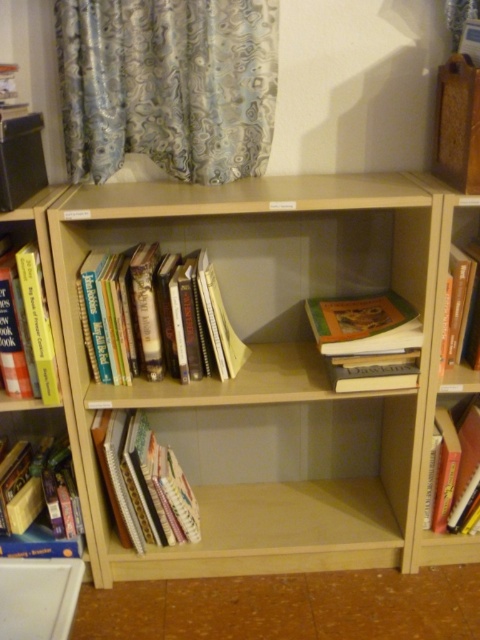
Question: Which point is farther from the camera taking this photo?

Choices:
 (A) (135, 67)
 (B) (23, 314)
 (C) (178, 321)
 (D) (248, 188)

Answer: (D)

Question: Does hardcover book at lower left appear on the left side of hardcover book at right?

Choices:
 (A) yes
 (B) no

Answer: (A)

Question: Is blue-patterned curtain at upper left closer to camera compared to hardcover books at center?

Choices:
 (A) yes
 (B) no

Answer: (A)

Question: Is hardcover books at center to the right of hardcover book at right from the viewer's perspective?

Choices:
 (A) yes
 (B) no

Answer: (B)

Question: Considering the real-world distances, which object is farthest from the hardcover book at left?

Choices:
 (A) blue-patterned curtain at upper left
 (B) hardcover books at lower left

Answer: (A)

Question: Which of these objects is positioned farthest from the hardcover book at lower right?

Choices:
 (A) light brown wood bookcase at center
 (B) hardcover book at left
 (C) hardcover books at lower left
 (D) blue-patterned curtain at upper left

Answer: (D)